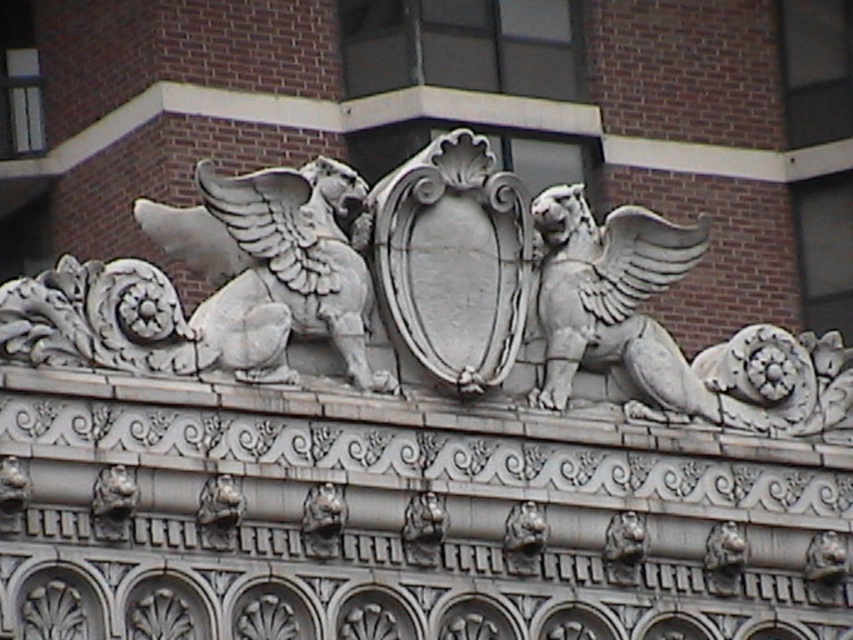
You are an architect examining the structure. You need to determine the spatial relationship between the white stone gryphon at right and the white stone winged lion at upper left. Is the gryphon positioned above or below the lion?

The white stone gryphon at right is below the white stone winged lion at upper left.

You are an architect analyzing the symmetry of the structure. The central shield is at the center of the image. Where is the white stone gryphon at right positioned relative to the central shield?

The white stone gryphon at right is positioned to the right of the central shield, as its 2D coordinates at point (665, 330) place it in the right half of the image.

You are an art student observing the architectural detail. You notice the white stone gryphon at right and the white stone winged lion at upper left. Which of these two statues is closer to your viewpoint?

The white stone gryphon at right is closer to the viewer than the white stone winged lion at upper left.